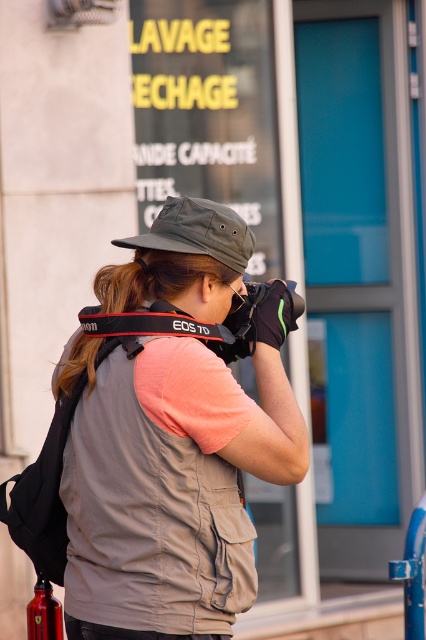
Question: Which of the following is the farthest from the observer?

Choices:
 (A) matte gray vest at center
 (B) red fabric camera strap at center
 (C) green matte hat at center

Answer: (C)

Question: Among these points, which one is nearest to the camera?

Choices:
 (A) 123,448
 (B) 114,320

Answer: (A)

Question: Is brown hair at center to the left of red fabric camera strap at center from the viewer's perspective?

Choices:
 (A) yes
 (B) no

Answer: (A)

Question: Does green matte hat at center appear on the right side of brown hair at center?

Choices:
 (A) no
 (B) yes

Answer: (B)

Question: Which of the following is the closest to the observer?

Choices:
 (A) brown hair at center
 (B) matte gray vest at center
 (C) red fabric camera strap at center
 (D) green matte hat at center

Answer: (B)

Question: Is matte gray vest at center above red fabric camera strap at center?

Choices:
 (A) yes
 (B) no

Answer: (B)